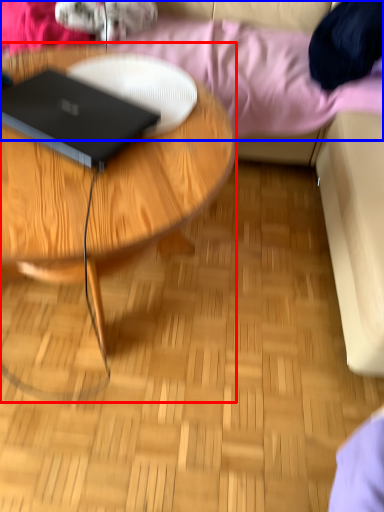
Question: Which of the following is the farthest to the observer, coffee table (highlighted by a red box) or bedding (highlighted by a blue box)?

Choices:
 (A) coffee table
 (B) bedding

Answer: (B)